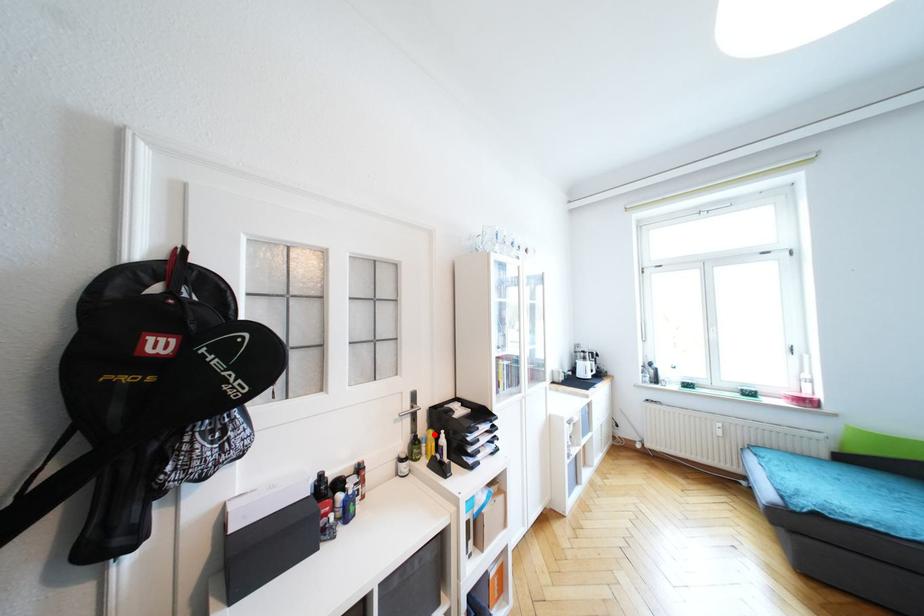
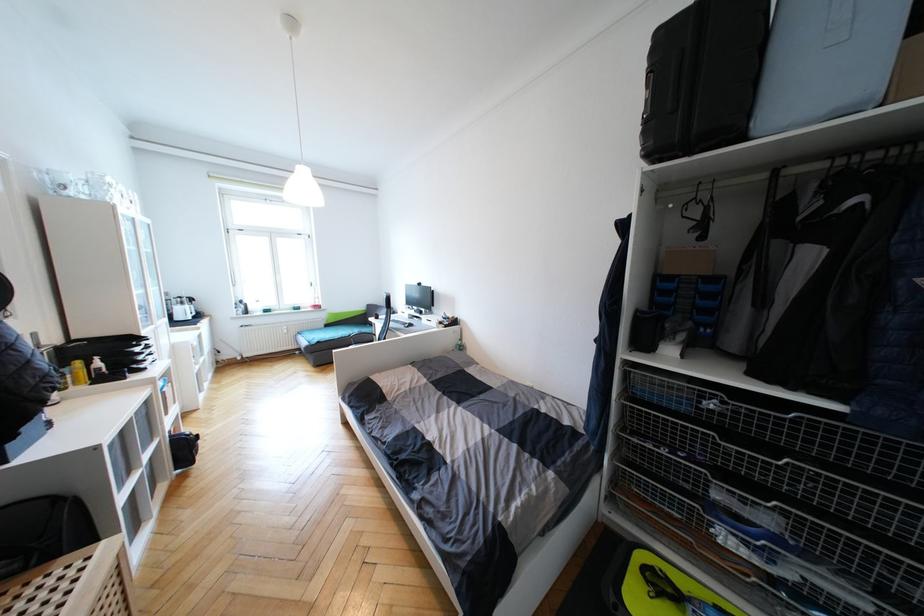
In the second image, find the point that corresponds to the highlighted location in the first image.

(81, 363)